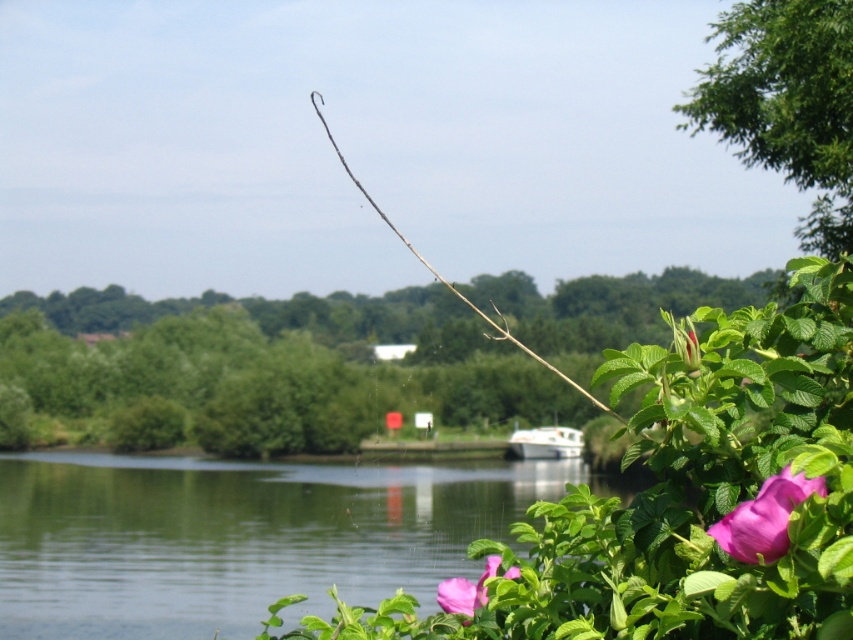
Question: Which is farther from the white glossy boat at center?

Choices:
 (A) pink matte flower at lower right
 (B) green leafy tree at center
 (C) green leafy tree at upper right
 (D) green smooth water at center

Answer: (A)

Question: Is green smooth water at center above green leafy tree at upper right?

Choices:
 (A) yes
 (B) no

Answer: (B)

Question: Which object appears farthest from the camera in this image?

Choices:
 (A) green leafy tree at upper right
 (B) pink matte flower at lower center
 (C) white glossy boat at center

Answer: (C)

Question: Does green leafy tree at center appear on the left side of green leafy tree at upper right?

Choices:
 (A) no
 (B) yes

Answer: (B)

Question: Which object is positioned farthest from the pink matte flower at lower center?

Choices:
 (A) green leafy tree at center
 (B) pink matte flower at lower right

Answer: (A)

Question: Is green leafy tree at upper right positioned at the back of pink matte flower at lower right?

Choices:
 (A) no
 (B) yes

Answer: (B)